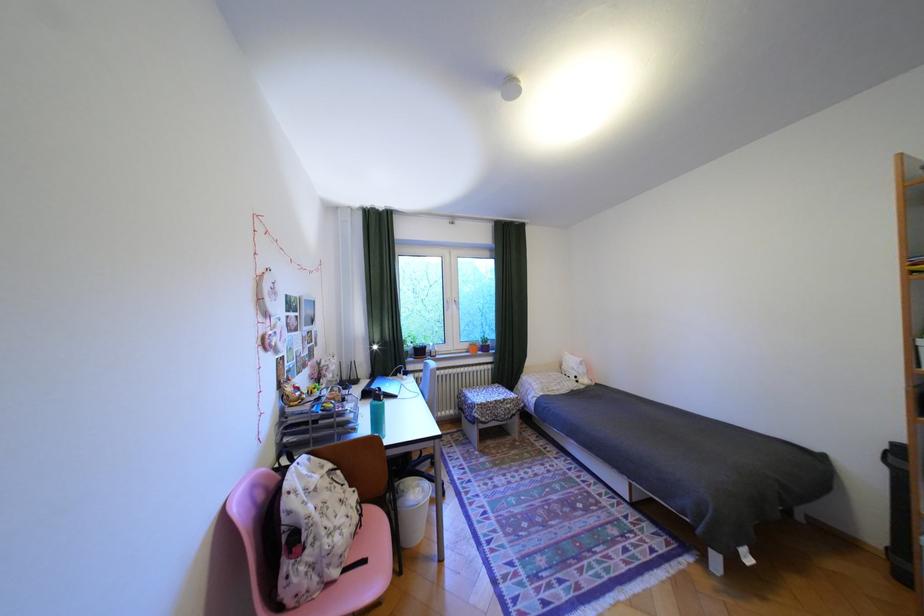
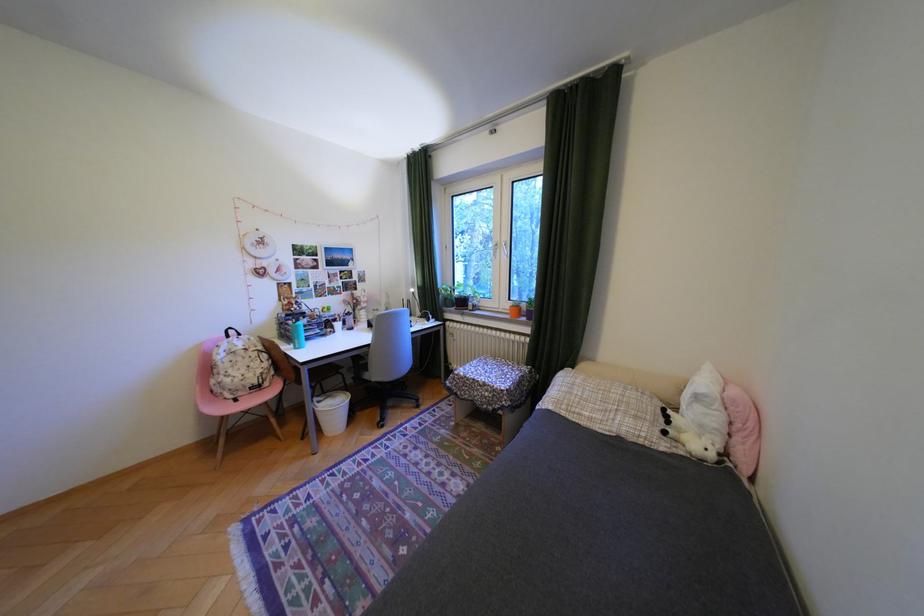
Find the pixel in the second image that matches point (432, 352) in the first image.

(475, 302)